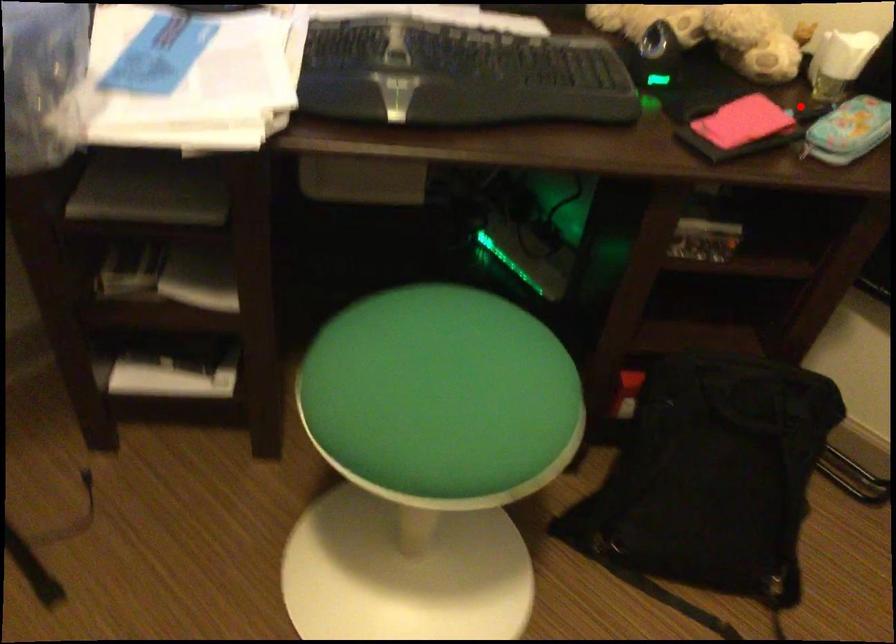
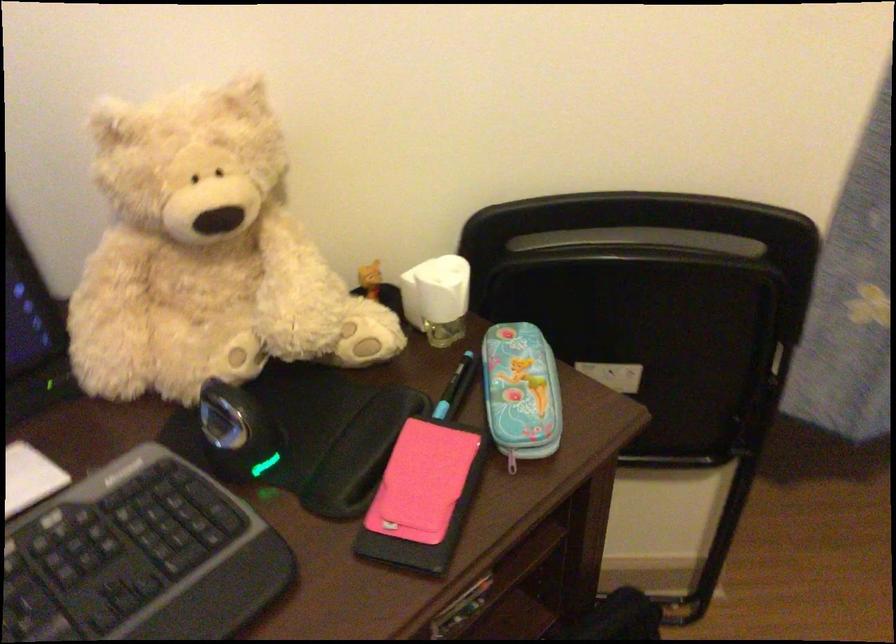
Question: A red point is marked in image1. In image2, is the corresponding 3D point closer to the camera or farther? Reply with the corresponding letter.

Choices:
 (A) The corresponding 3D point is closer.
 (B) The corresponding 3D point is farther.

Answer: (A)